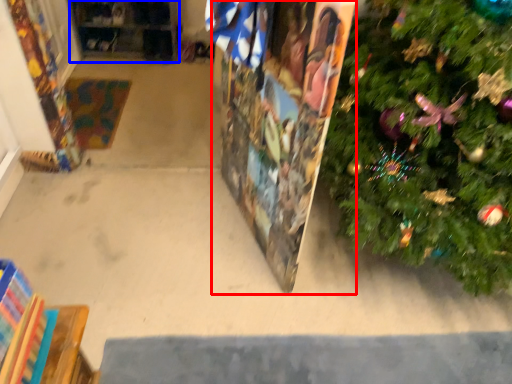
Question: Which object is further to the camera taking this photo, bulletin board (highlighted by a red box) or shelf (highlighted by a blue box)?

Choices:
 (A) bulletin board
 (B) shelf

Answer: (B)